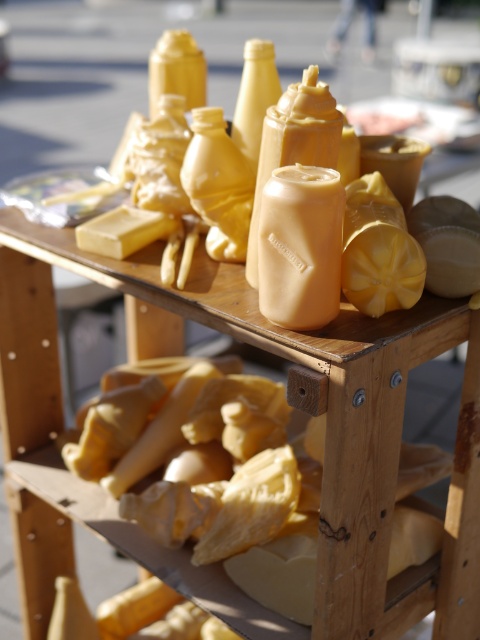
You are a customer at the market and see the matte yellow cheese at center and the yellow wax block at center on the table. Which item is positioned lower on the table?

The matte yellow cheese at center is positioned lower because it is below the yellow wax block at center on the table.